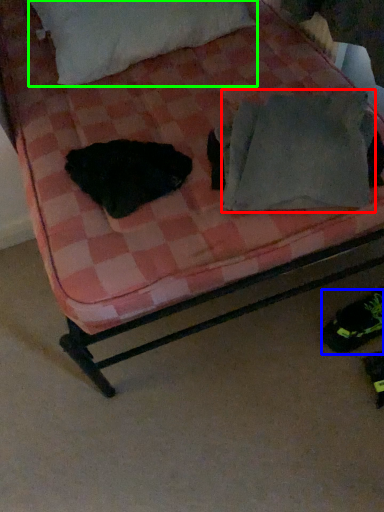
Question: Based on their relative distances, which object is farther from pillow (highlighted by a red box)? Choose from footwear (highlighted by a blue box) and pillow (highlighted by a green box).

Choices:
 (A) footwear
 (B) pillow

Answer: (B)